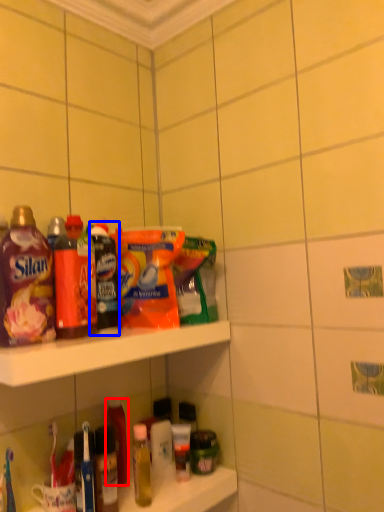
Question: Which of the following is the farthest to the observer, bottle (highlighted by a red box) or product (highlighted by a blue box)?

Choices:
 (A) bottle
 (B) product

Answer: (A)